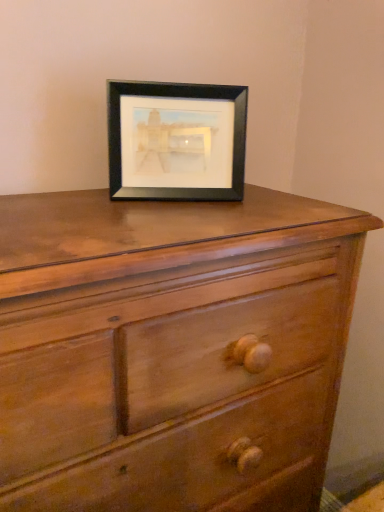
Question: Is point (x=193, y=476) closer or farther from the camera than point (x=107, y=95)?

Choices:
 (A) closer
 (B) farther

Answer: (A)

Question: Would you say matte wood chest of drawers at center is inside or outside black matte picture frame at upper center?

Choices:
 (A) inside
 (B) outside

Answer: (B)

Question: Considering the positions of matte wood chest of drawers at center and black matte picture frame at upper center in the image, is matte wood chest of drawers at center taller or shorter than black matte picture frame at upper center?

Choices:
 (A) tall
 (B) short

Answer: (A)

Question: Considering the positions of point (135, 193) and point (56, 285), is point (135, 193) closer or farther from the camera than point (56, 285)?

Choices:
 (A) closer
 (B) farther

Answer: (B)

Question: Is black matte picture frame at upper center situated inside matte wood chest of drawers at center or outside?

Choices:
 (A) outside
 (B) inside

Answer: (A)

Question: In terms of width, does black matte picture frame at upper center look wider or thinner when compared to matte wood chest of drawers at center?

Choices:
 (A) wide
 (B) thin

Answer: (B)

Question: Considering the relative positions of black matte picture frame at upper center and matte wood chest of drawers at center in the image provided, is black matte picture frame at upper center to the left or to the right of matte wood chest of drawers at center?

Choices:
 (A) left
 (B) right

Answer: (B)